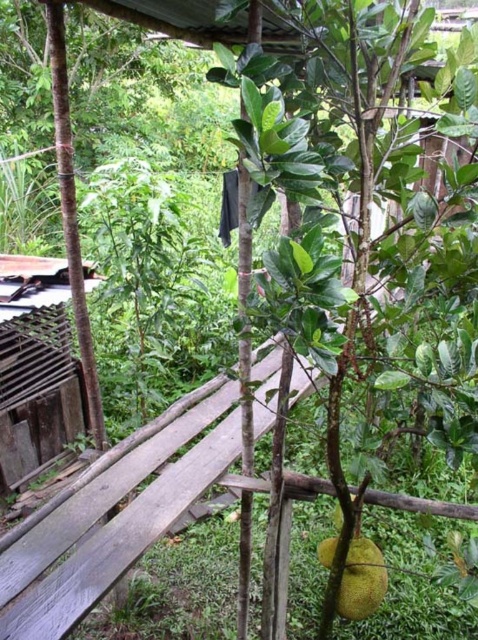
You are standing on the wooden platform and looking at two points in the scene. The first point is at coordinates point [50,593] and the second is at point [341,576]. Which point is closer to you?

Result: Point [50,593] is closer to the camera than point [341,576].

You are standing on a wooden platform overlooking a lush green area. You see a weathered wood bench at center. Based on its position coordinates, can you determine if the bench is closer to the edge of the platform or the center?

The weathered wood bench at center is positioned at coordinates point (x=112, y=516), which places it closer to the edge of the platform rather than the exact center.

You are a painter standing on the wooden platform. You want to paint both the weathered wood bench at center and the yellow matte jackfruit at center. Which object should you look up to paint?

You should look up to paint the weathered wood bench at center because it is much taller than the yellow matte jackfruit at center.